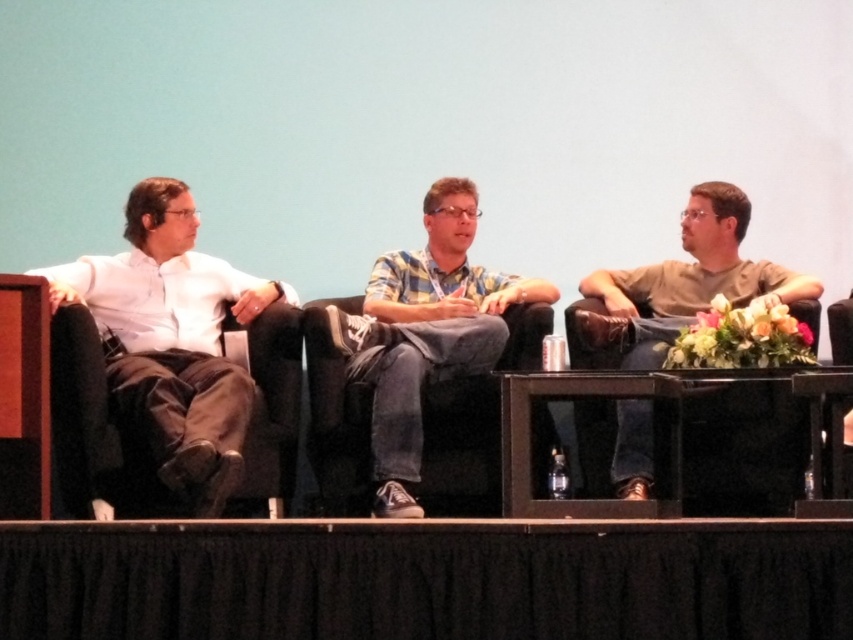
Question: Which of the following is the closest to the observer?

Choices:
 (A) white matte shirt at left
 (B) plaid shirt at center
 (C) brown cotton shirt at right

Answer: (A)

Question: Considering the relative positions of plaid shirt at center and brown cotton shirt at right in the image provided, where is plaid shirt at center located with respect to brown cotton shirt at right?

Choices:
 (A) left
 (B) right

Answer: (A)

Question: Can you confirm if white matte shirt at left is positioned to the right of brown cotton shirt at right?

Choices:
 (A) yes
 (B) no

Answer: (B)

Question: Which object is closer to the camera taking this photo?

Choices:
 (A) white matte shirt at left
 (B) brown cotton shirt at right

Answer: (A)

Question: Can you confirm if white matte shirt at left is positioned to the right of plaid shirt at center?

Choices:
 (A) no
 (B) yes

Answer: (A)

Question: Which point is closer to the camera?

Choices:
 (A) brown cotton shirt at right
 (B) plaid shirt at center

Answer: (A)